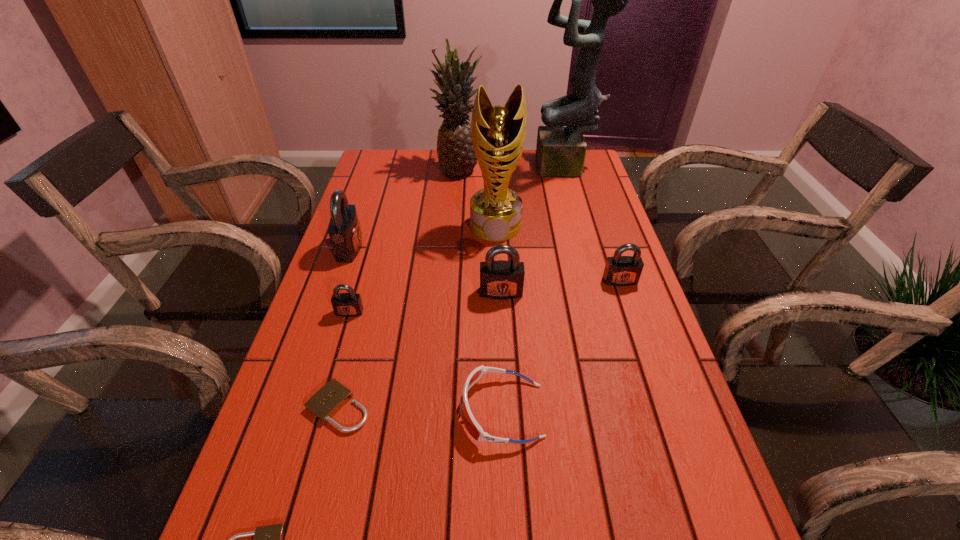
In order to click on the nearest gray padlock in this screenshot , I will do `click(349, 304)`.

Identify the location of the fourth farthest padlock. (349, 304).

Locate an element on the screen. The height and width of the screenshot is (540, 960). goggles is located at coordinates [475, 430].

Where is `the third shortest object`? This screenshot has width=960, height=540. the third shortest object is located at coordinates (475, 430).

I want to click on the second nearest padlock, so click(x=327, y=401).

This screenshot has width=960, height=540. In order to click on the second shortest padlock in this screenshot , I will do `click(327, 401)`.

In order to click on vacant space located on the face of the gray sculpture in this screenshot , I will do `click(458, 169)`.

Identify the location of vacant space located 0.260m on the face of the gray sculpture. (461, 169).

Locate an element on the screen. This screenshot has width=960, height=540. vacant space positioned on the face of the gray sculpture is located at coordinates (464, 169).

Locate an element on the screen. The height and width of the screenshot is (540, 960). vacant space located on the right of the pineapple is located at coordinates (528, 168).